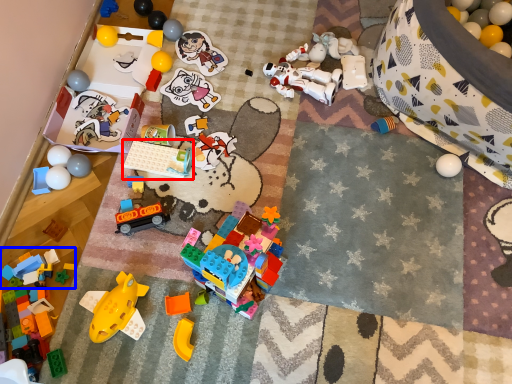
Question: Which object appears closest to the camera in this image, toy (highlighted by a red box) or toy (highlighted by a blue box)?

Choices:
 (A) toy
 (B) toy

Answer: (B)